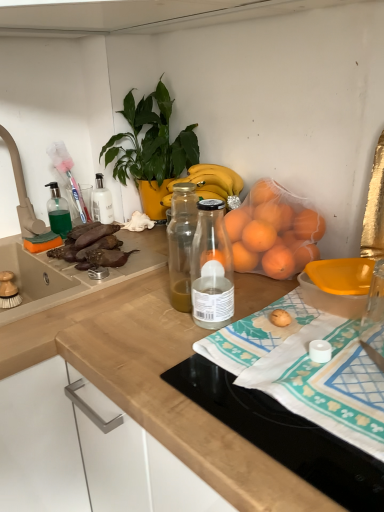
Locate an element on the screen. vacant area that lies in front of brown matte eggplant at left is located at coordinates (76, 288).